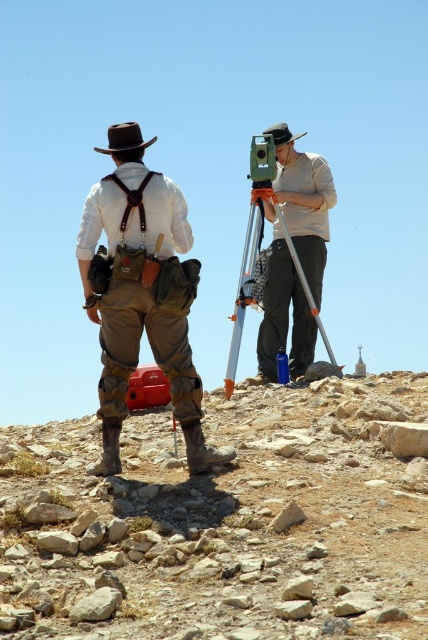
Question: Is the position of silver metallic tripod at center more distant than that of brown leather cowboy hat at upper center?

Choices:
 (A) no
 (B) yes

Answer: (A)

Question: Considering the real-world distances, which object is closest to the brown leather cowboy hat at upper center?

Choices:
 (A) silver metallic tripod at center
 (B) dusty stone hillside at lower left
 (C) leather suspenders at center
 (D) brown felt cowboy hat at upper left

Answer: (A)

Question: Which point appears closest to the camera in this image?

Choices:
 (A) (119, 138)
 (B) (288, 138)
 (C) (171, 182)

Answer: (A)

Question: Estimate the real-world distances between objects in this image. Which object is farther from the silver metallic tripod at center?

Choices:
 (A) brown felt cowboy hat at upper left
 (B) leather suspenders at center

Answer: (B)

Question: Can you confirm if leather suspenders at center is positioned below silver metallic tripod at center?

Choices:
 (A) yes
 (B) no

Answer: (A)

Question: Is leather suspenders at center below silver metallic tripod at center?

Choices:
 (A) yes
 (B) no

Answer: (A)